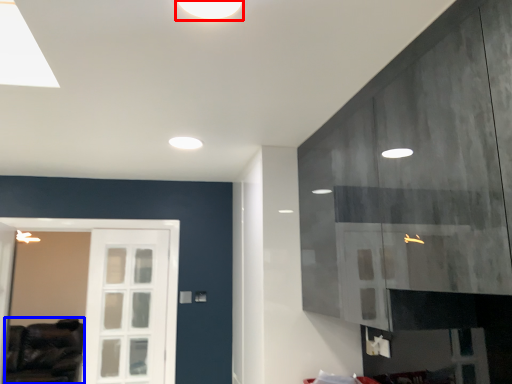
Question: Which object appears closest to the camera in this image, lighting (highlighted by a red box) or furniture (highlighted by a blue box)?

Choices:
 (A) lighting
 (B) furniture

Answer: (A)